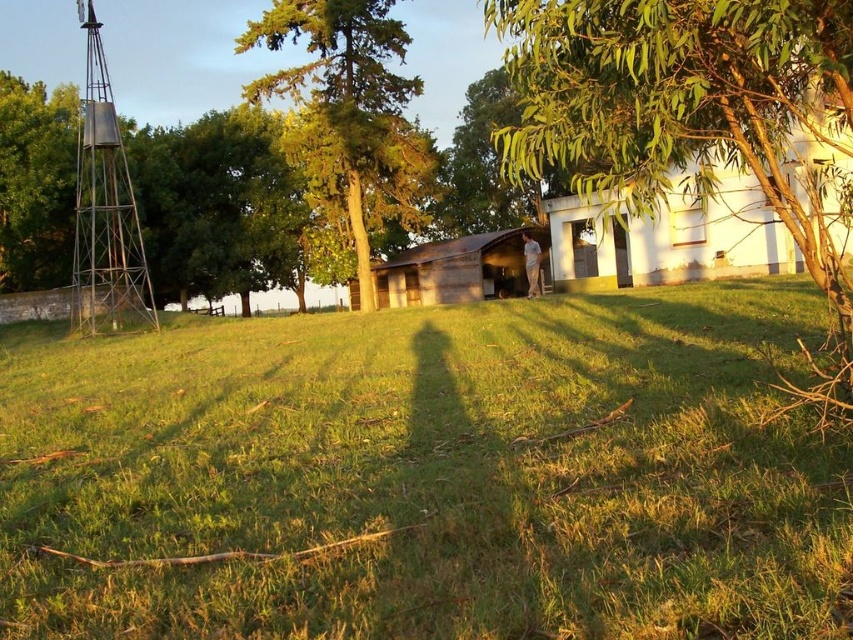
Question: Estimate the real-world distances between objects in this image. Which object is farther from the green leafy tree at center?

Choices:
 (A) green textured tree at center
 (B) green grass at center

Answer: (A)

Question: Which point appears farthest from the camera in this image?

Choices:
 (A) (115, 138)
 (B) (318, 120)
 (C) (622, 291)

Answer: (B)

Question: Is green grass at center bigger than green leafy tree at upper center?

Choices:
 (A) yes
 (B) no

Answer: (B)

Question: Which object is closer to the camera taking this photo?

Choices:
 (A) metallic water tower at left
 (B) green leafy tree at center

Answer: (B)

Question: Can you confirm if green leafy tree at center is positioned above metallic water tower at left?

Choices:
 (A) no
 (B) yes

Answer: (A)

Question: Is green grass at center in front of green textured tree at center?

Choices:
 (A) yes
 (B) no

Answer: (A)